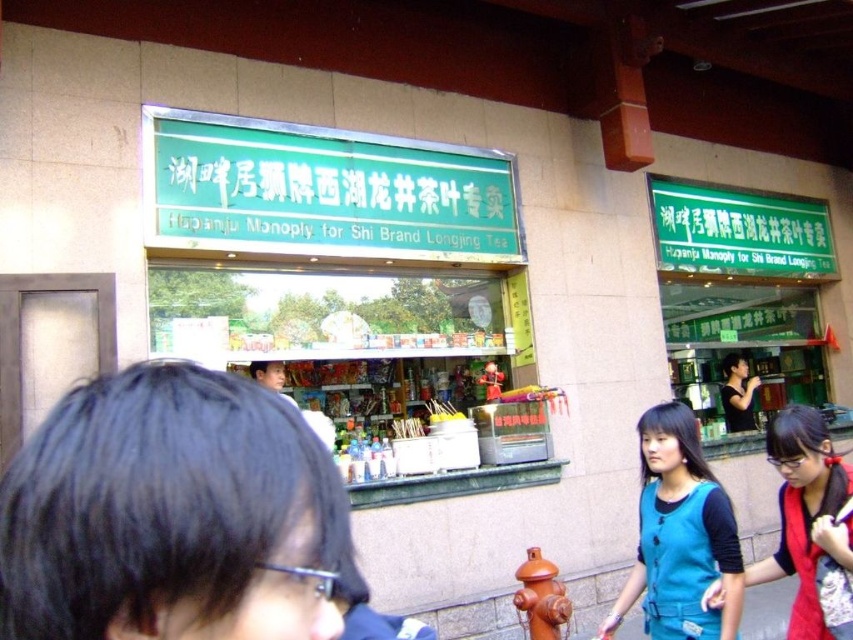
Question: Which object is farther from the camera taking this photo?

Choices:
 (A) orange matte hydrant at lower center
 (B) blue fabric shirt at center
 (C) blue fabric pants at lower center
 (D) teal fabric vest at center

Answer: (C)

Question: Is orange matte hydrant at lower center to the right of black matte shirt at center from the viewer's perspective?

Choices:
 (A) yes
 (B) no

Answer: (B)

Question: Is the position of orange matte hydrant at lower center less distant than that of black matte shirt at center?

Choices:
 (A) yes
 (B) no

Answer: (A)

Question: Among these points, which one is nearest to the camera?

Choices:
 (A) (763, 624)
 (B) (691, 493)

Answer: (B)

Question: Which point is closer to the camera?

Choices:
 (A) orange matte hydrant at lower center
 (B) blue fabric pants at lower center
 (C) black matte shirt at center
 (D) smooth black hair at center

Answer: (D)

Question: Where is orange matte hydrant at lower center located in relation to blue fabric pants at lower center in the image?

Choices:
 (A) left
 (B) right

Answer: (A)